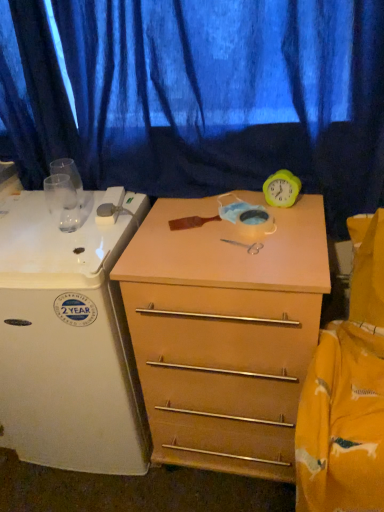
I want to click on free spot above light wood/finish chest of drawers at center (from a real-world perspective), so click(x=237, y=226).